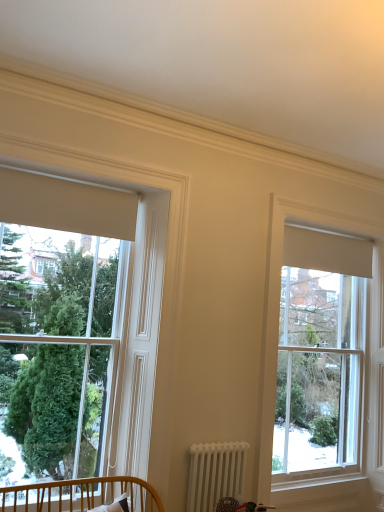
Question: Is wooden crib at lower left surrounded by white metallic radiator at lower center?

Choices:
 (A) no
 (B) yes

Answer: (A)

Question: Is white metallic radiator at lower center taller than wooden crib at lower left?

Choices:
 (A) yes
 (B) no

Answer: (A)

Question: Does white metallic radiator at lower center come behind wooden crib at lower left?

Choices:
 (A) no
 (B) yes

Answer: (B)

Question: Considering the relative positions of white metallic radiator at lower center and wooden crib at lower left in the image provided, is white metallic radiator at lower center to the left of wooden crib at lower left from the viewer's perspective?

Choices:
 (A) yes
 (B) no

Answer: (B)

Question: Does white metallic radiator at lower center have a lesser height compared to wooden crib at lower left?

Choices:
 (A) no
 (B) yes

Answer: (A)

Question: From a real-world perspective, is wooden crib at lower left positioned above or below white metallic radiator at lower center?

Choices:
 (A) below
 (B) above

Answer: (A)

Question: In terms of width, does wooden crib at lower left look wider or thinner when compared to white metallic radiator at lower center?

Choices:
 (A) thin
 (B) wide

Answer: (B)

Question: Considering the positions of point (132, 486) and point (226, 479), is point (132, 486) closer or farther from the camera than point (226, 479)?

Choices:
 (A) closer
 (B) farther

Answer: (A)

Question: From the image's perspective, is wooden crib at lower left above or below white metallic radiator at lower center?

Choices:
 (A) below
 (B) above

Answer: (B)

Question: From a real-world perspective, is white metallic radiator at lower center above or below matte white window at left, which ranks as the 1th window in left-to-right order?

Choices:
 (A) above
 (B) below

Answer: (B)

Question: Is white metallic radiator at lower center inside or outside of matte white window at left, which is the second window in back-to-front order?

Choices:
 (A) outside
 (B) inside

Answer: (A)

Question: From the image's perspective, is white metallic radiator at lower center located above or below matte white window at left, positioned as the 2th window in right-to-left order?

Choices:
 (A) above
 (B) below

Answer: (B)

Question: Looking at their shapes, would you say white metallic radiator at lower center is wider or thinner than matte white window at left, which ranks as the 1th window in left-to-right order?

Choices:
 (A) wide
 (B) thin

Answer: (A)

Question: Based on their sizes in the image, would you say clear glass window at upper right, the 1th window when ordered from back to front, is bigger or smaller than white metallic radiator at lower center?

Choices:
 (A) big
 (B) small

Answer: (A)

Question: Which is correct: clear glass window at upper right, the second window in the left-to-right sequence, is inside white metallic radiator at lower center, or outside of it?

Choices:
 (A) inside
 (B) outside

Answer: (B)